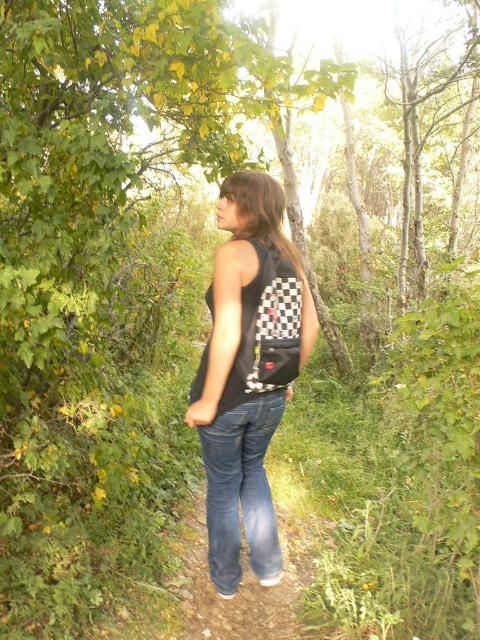
Does denim at center have a lesser height compared to checkered fabric backpack at center?

No.

At what (x,y) coordinates should I click in order to perform the action: click on denim at center. Please return your answer as a coordinate pair (x, y). The height and width of the screenshot is (640, 480). Looking at the image, I should click on (240, 490).

Between point (242, 266) and point (289, 282), which one is positioned in front?

Positioned in front is point (242, 266).

Looking at this image, measure the distance between black checkered backpack at center and checkered fabric backpack at center.

The distance of black checkered backpack at center from checkered fabric backpack at center is 6.76 inches.

Is point (260, 541) closer to camera compared to point (286, 300)?

That is False.

At what (x,y) coordinates should I click in order to perform the action: click on black checkered backpack at center. Please return your answer as a coordinate pair (x, y). Looking at the image, I should click on (248, 372).

Is black checkered backpack at center taller than denim at center?

Yes, black checkered backpack at center is taller than denim at center.

Does black checkered backpack at center come behind denim at center?

No, black checkered backpack at center is closer to the viewer.

Which is in front, point (201, 410) or point (267, 396)?

Point (201, 410)

Where is `black checkered backpack at center`? black checkered backpack at center is located at coordinates (248, 372).